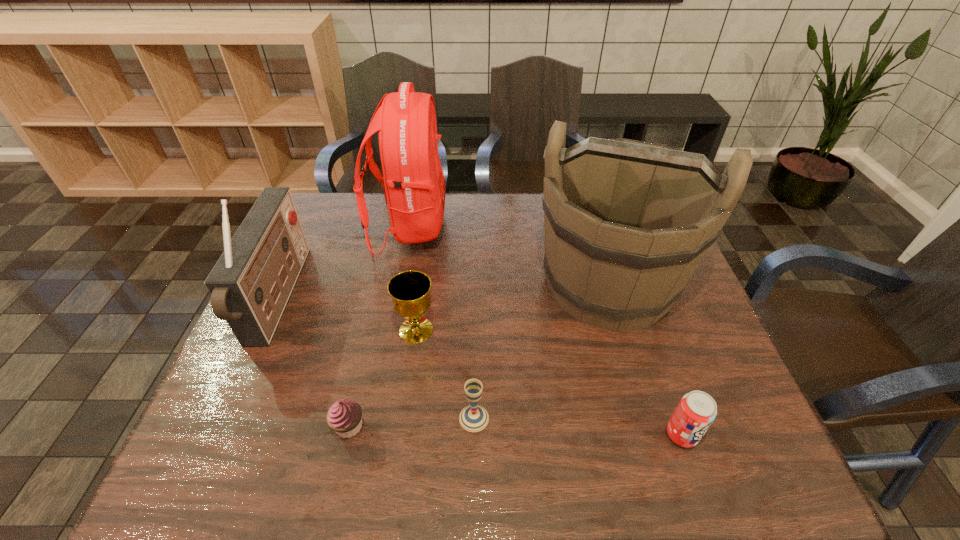
Where is `vacant region between the bucket and the leftmost object`? The image size is (960, 540). vacant region between the bucket and the leftmost object is located at coordinates (444, 291).

Choose which object is the nearest neighbor to the fifth shortest object. Please provide its 2D coordinates. Your answer should be formatted as a tuple, i.e. [(x, y)], where the tuple contains the x and y coordinates of a point satisfying the conditions above.

[(414, 182)]

Locate an element on the screen. object that can be found as the closest to the bucket is located at coordinates tap(697, 410).

This screenshot has height=540, width=960. In order to click on vacant space that satisfies the following two spatial constraints: 1. on the front panel of the soda can; 2. on the right side of the third tallest object in this screenshot , I will do `click(218, 435)`.

I want to click on free space that satisfies the following two spatial constraints: 1. on the front panel of the third tallest object; 2. on the left side of the right chalice, so click(x=226, y=418).

This screenshot has height=540, width=960. Find the location of `free space that satisfies the following two spatial constraints: 1. on the back side of the shortest object; 2. on the left side of the left chalice`. free space that satisfies the following two spatial constraints: 1. on the back side of the shortest object; 2. on the left side of the left chalice is located at coordinates (371, 330).

Find the location of a particular element. This screenshot has height=540, width=960. vacant space that satisfies the following two spatial constraints: 1. on the main compartment of the backpack; 2. on the right side of the soda can is located at coordinates (371, 435).

Identify the location of vacant space that satisfies the following two spatial constraints: 1. on the back side of the right chalice; 2. on the right side of the bucket. (475, 284).

Where is `free space that satisfies the following two spatial constraints: 1. on the main compartment of the soda can; 2. on the left side of the backpack`? This screenshot has width=960, height=540. free space that satisfies the following two spatial constraints: 1. on the main compartment of the soda can; 2. on the left side of the backpack is located at coordinates (371, 435).

Find the location of `free location that satisfies the following two spatial constraints: 1. on the main compartment of the third object from right to left; 2. on the right side of the backpack`. free location that satisfies the following two spatial constraints: 1. on the main compartment of the third object from right to left; 2. on the right side of the backpack is located at coordinates (373, 418).